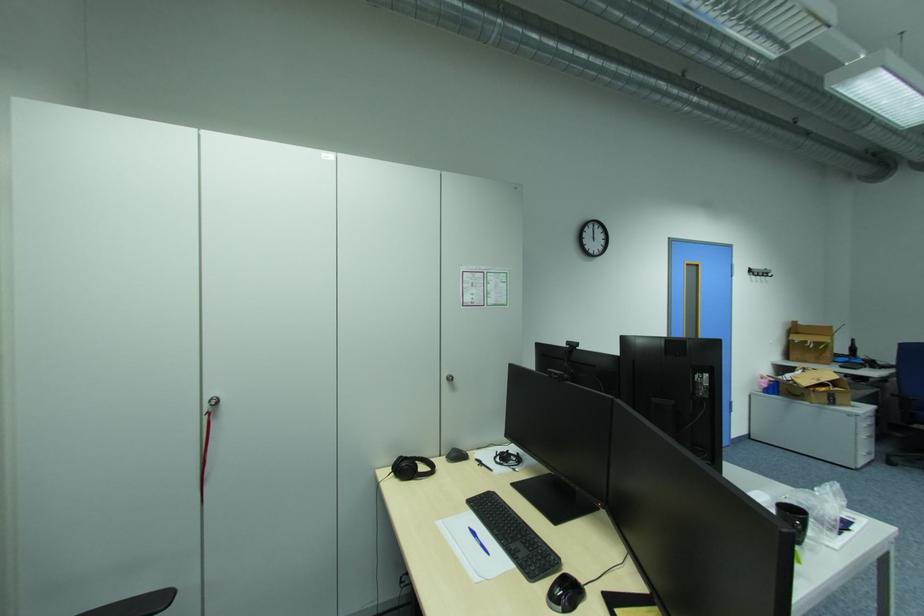
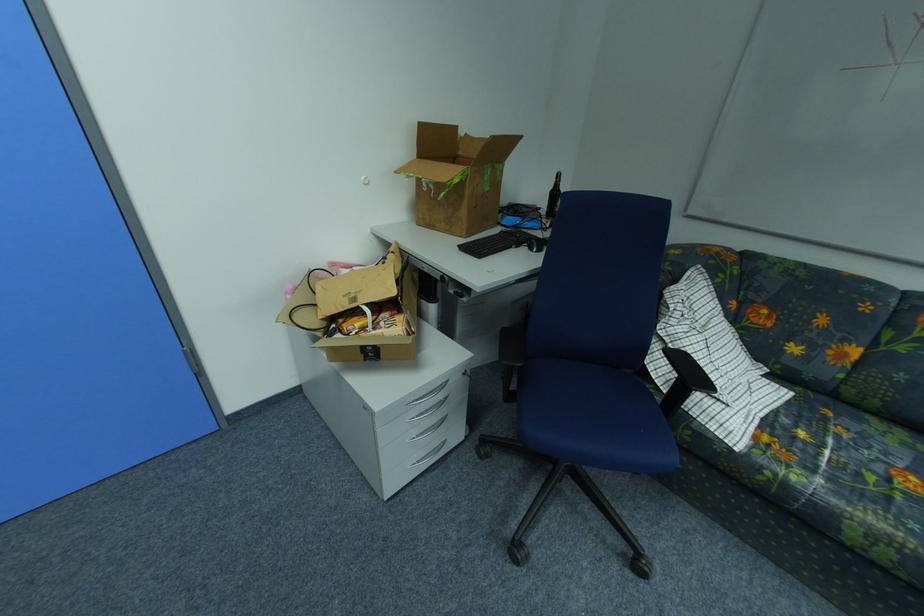
The point at [837,355] is marked in the first image. Where is the corresponding point in the second image?

(470, 214)